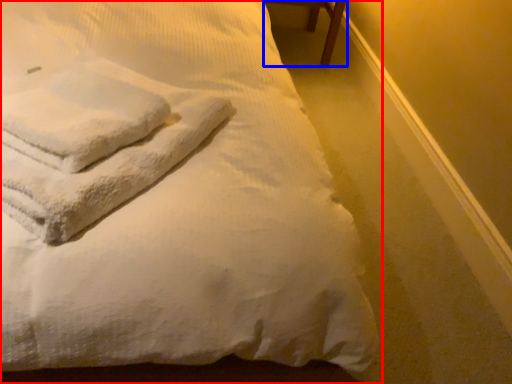
Question: Which object is further to the camera taking this photo, bed (highlighted by a red box) or furniture (highlighted by a blue box)?

Choices:
 (A) bed
 (B) furniture

Answer: (B)